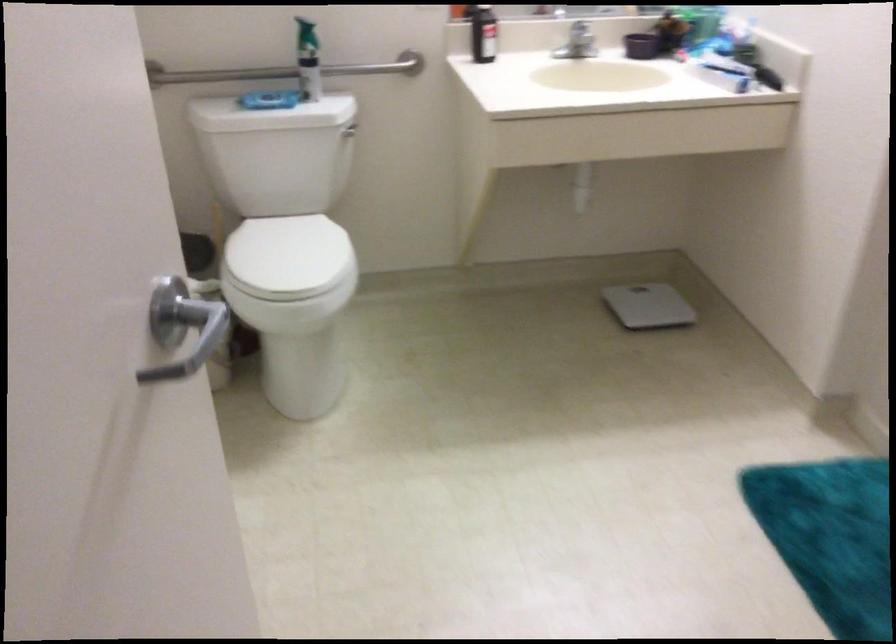
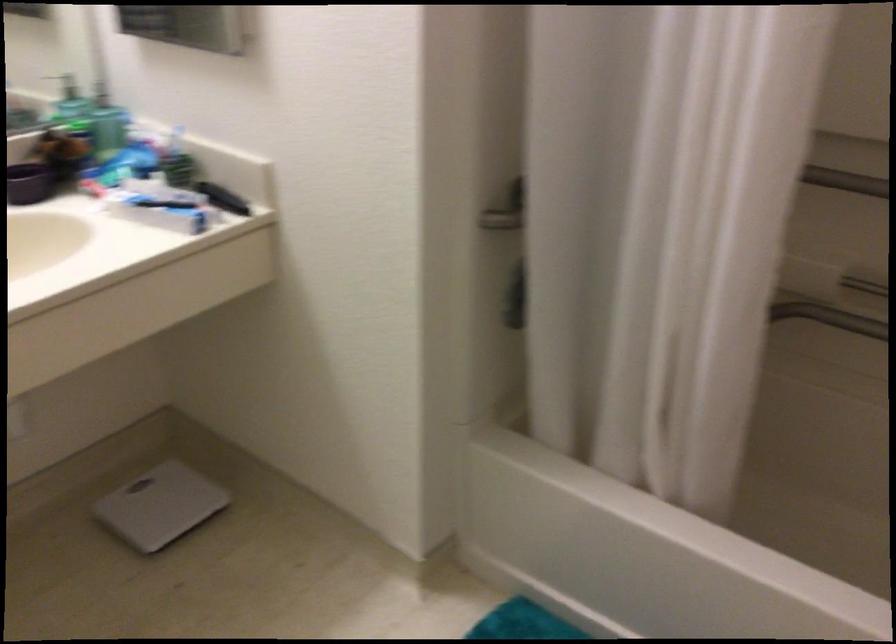
Question: The camera is either moving clockwise (left) or counter-clockwise (right) around the object. The first image is from the beginning of the video and the second image is from the end. Is the camera moving left or right when shooting the video?

Choices:
 (A) Left
 (B) Right

Answer: (A)